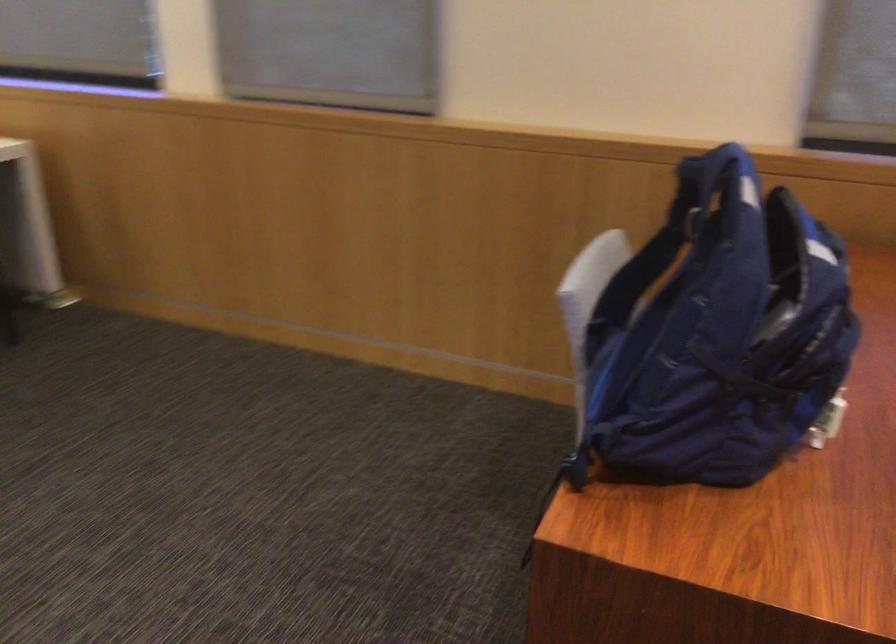
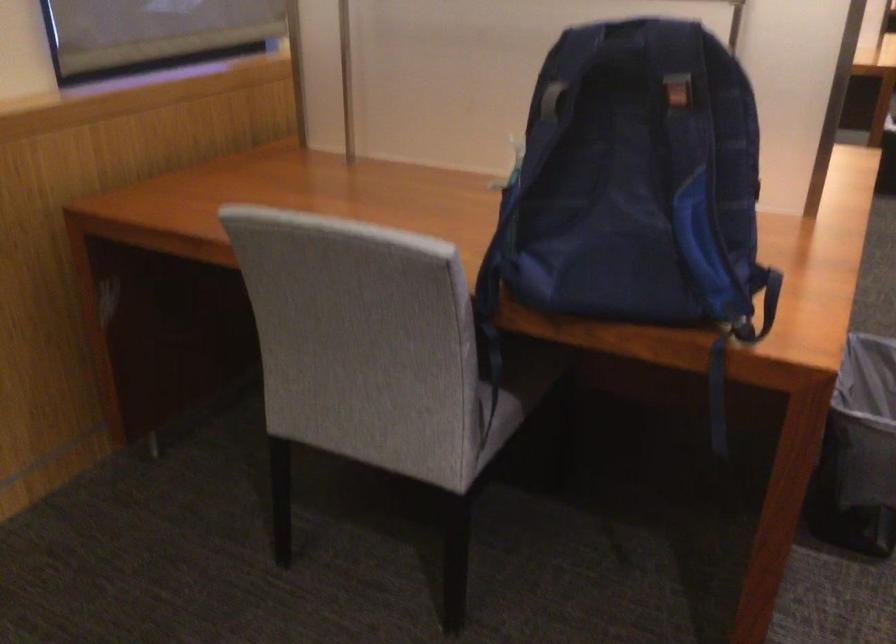
Locate, in the second image, the point that corresponds to the point at 549,534 in the first image.

(718, 395)